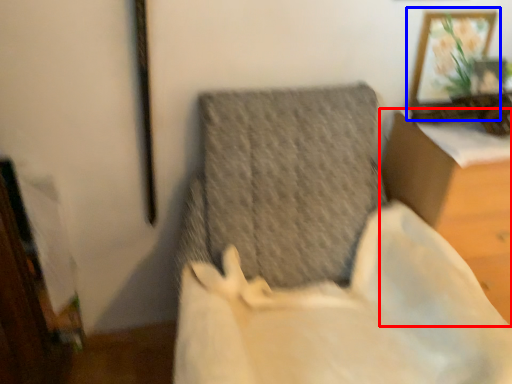
Question: Which of the following is the farthest to the observer, furniture (highlighted by a red box) or picture frame (highlighted by a blue box)?

Choices:
 (A) furniture
 (B) picture frame

Answer: (B)